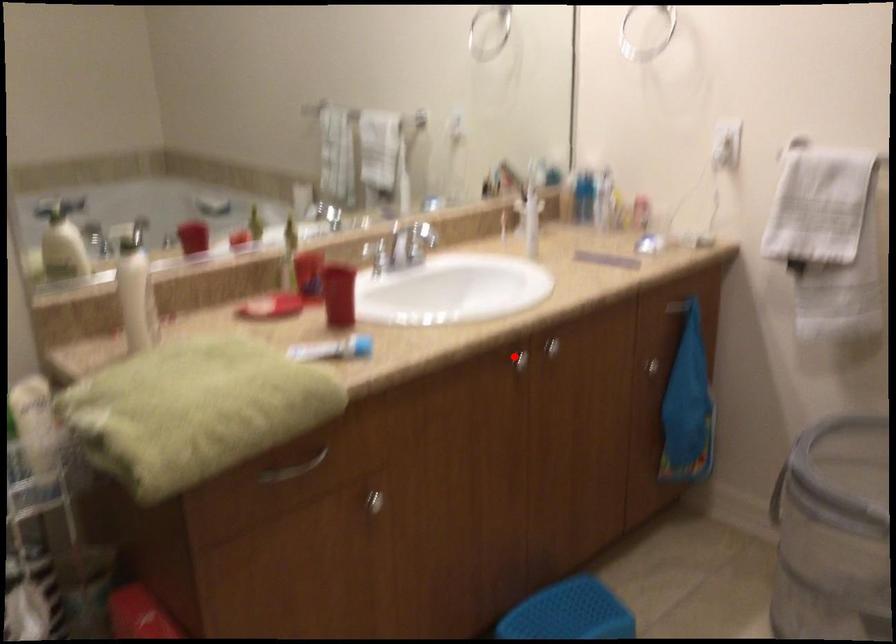
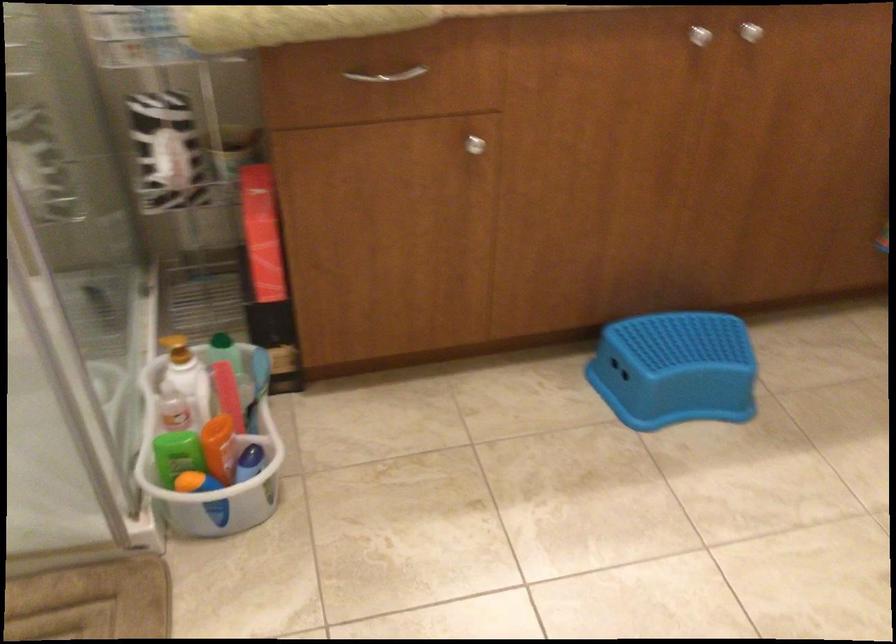
Find the pixel in the second image that matches the highlighted location in the first image.

(700, 35)